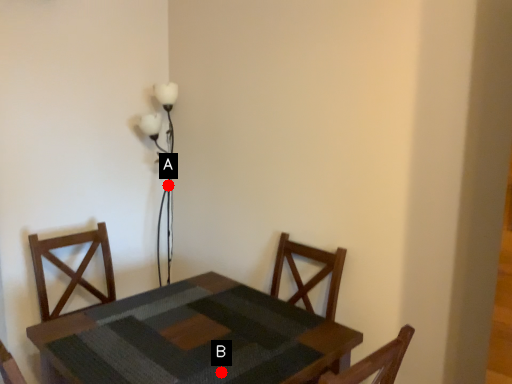
Question: Two points are circled on the image, labeled by A and B beside each circle. Which point is closer to the camera taking this photo?

Choices:
 (A) A is closer
 (B) B is closer

Answer: (B)